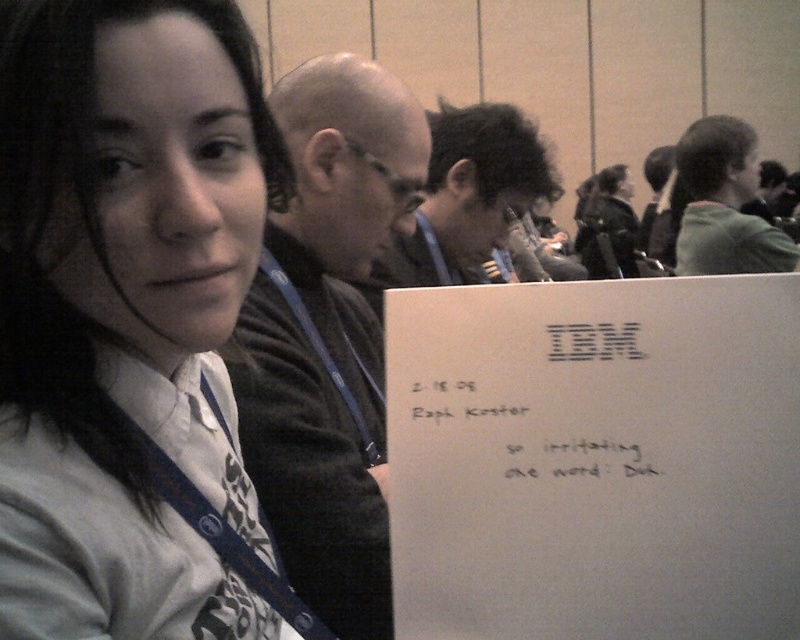
Is dark gray sweater at center taller than green fabric jacket at upper right?

Yes, dark gray sweater at center is taller than green fabric jacket at upper right.

The image size is (800, 640). What do you see at coordinates (328, 336) in the screenshot?
I see `dark gray sweater at center` at bounding box center [328, 336].

At what (x,y) coordinates should I click in order to perform the action: click on dark gray sweater at center. Please return your answer as a coordinate pair (x, y). Image resolution: width=800 pixels, height=640 pixels. Looking at the image, I should click on (328, 336).

Is matte white shirt at center wider than dark gray sweater at center?

No.

Who is lower down, matte white shirt at center or dark gray sweater at center?

Positioned lower is matte white shirt at center.

Which is in front, point (97, 360) or point (346, 84)?

Point (97, 360) is more forward.

I want to click on matte white shirt at center, so click(x=130, y=320).

Can you confirm if dark gray sweater at center is positioned to the left of dark brown hair at center?

Yes, dark gray sweater at center is to the left of dark brown hair at center.

Where is `dark gray sweater at center`? dark gray sweater at center is located at coordinates (328, 336).

At what (x,y) coordinates should I click in order to perform the action: click on dark gray sweater at center. Please return your answer as a coordinate pair (x, y). This screenshot has height=640, width=800. Looking at the image, I should click on (328, 336).